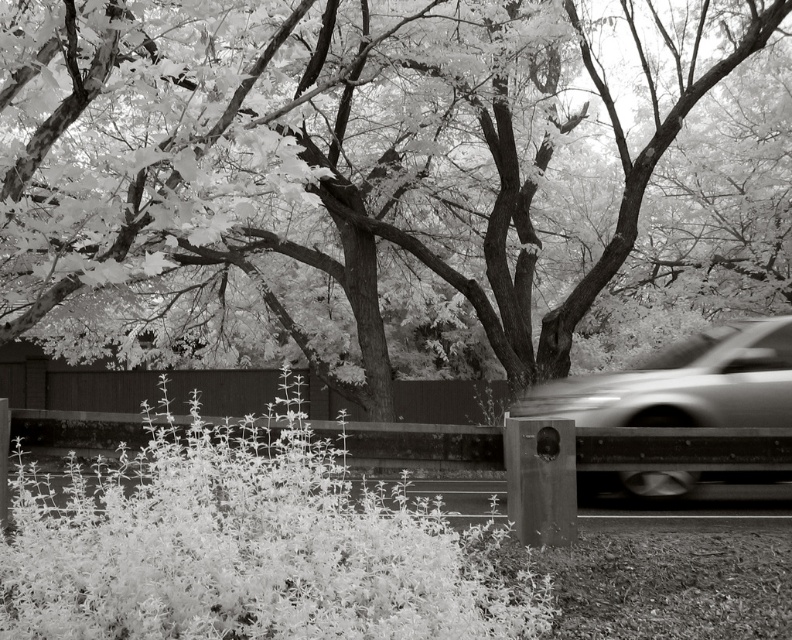
You are standing in front of the scene and want to know which of the two points, point (193, 195) or point (752, 348), is nearer to you. Can you tell me which one?

Point (193, 195) is closer to the viewer than point (752, 348).